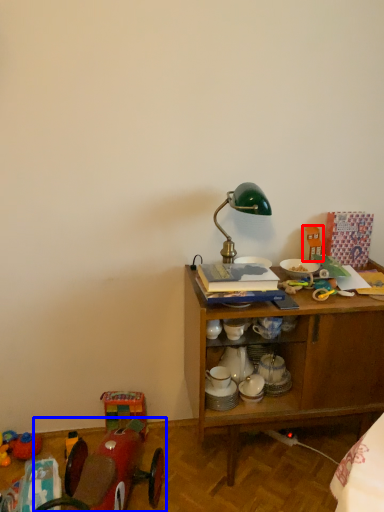
Question: Among these objects, which one is nearest to the camera, toy (highlighted by a red box) or toy (highlighted by a blue box)?

Choices:
 (A) toy
 (B) toy

Answer: (B)